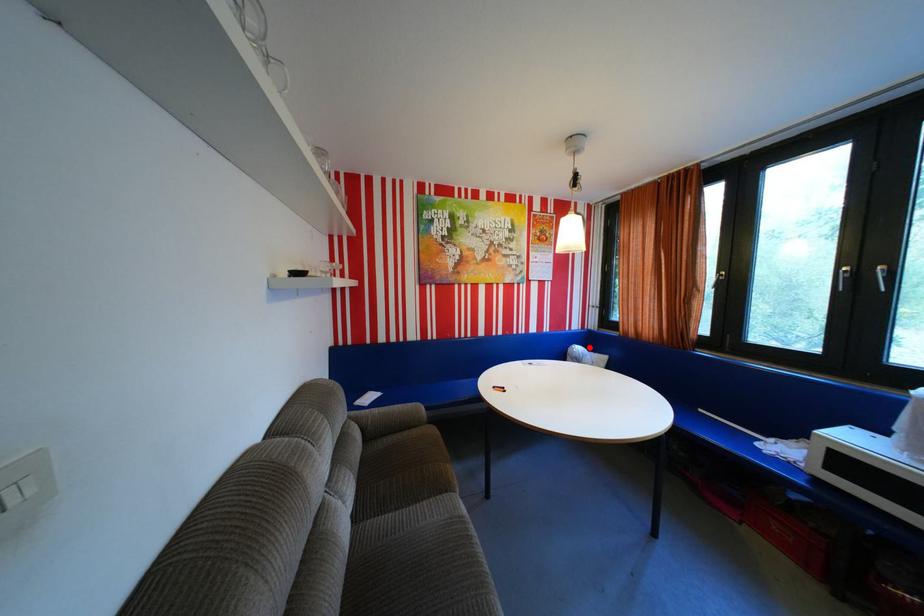
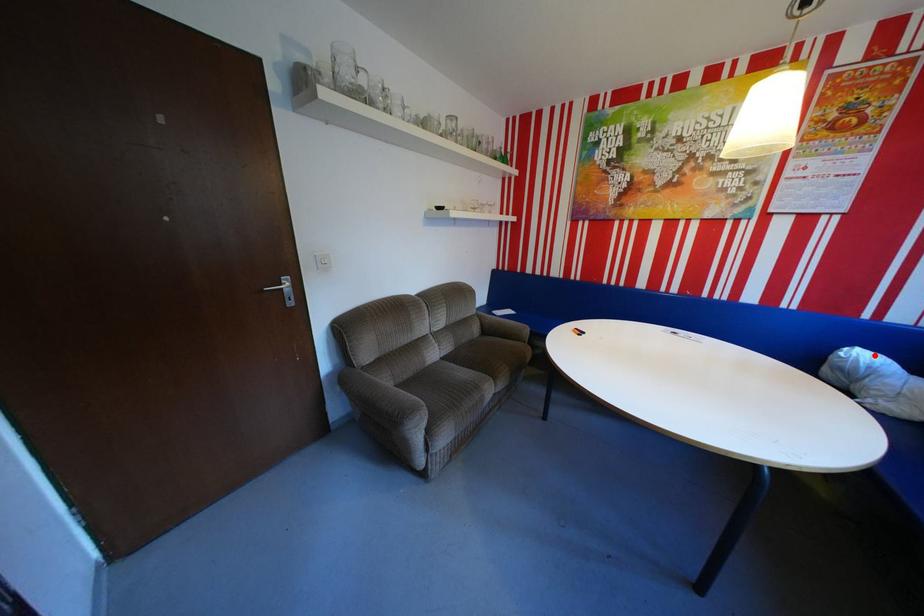
I am providing you with two images of the same scene from different viewpoints. A red point is marked on the first image and another point is marked on the second image. Do the highlighted points in image1 and image2 indicate the same real-world spot?

Yes